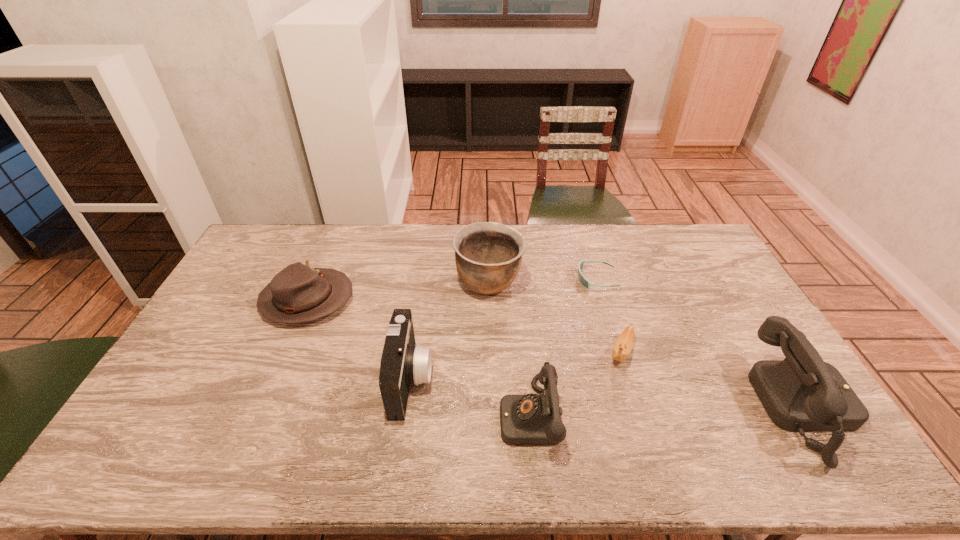
Locate an element on the screen. The image size is (960, 540). the shorter telephone is located at coordinates (533, 419).

The height and width of the screenshot is (540, 960). What are the coordinates of `the fourth shortest object` in the screenshot? It's located at (533, 419).

Locate an element on the screen. The width and height of the screenshot is (960, 540). the right telephone is located at coordinates (801, 393).

Identify the location of the rightmost object. (801, 393).

In order to click on goggles in this screenshot , I will do `click(583, 281)`.

This screenshot has height=540, width=960. Find the location of `pottery`. pottery is located at coordinates (488, 255).

The height and width of the screenshot is (540, 960). Identify the location of hat. (297, 294).

Identify the location of the fifth tallest object. This screenshot has width=960, height=540. (297, 294).

Where is `the second shortest object`? This screenshot has height=540, width=960. the second shortest object is located at coordinates (622, 348).

This screenshot has width=960, height=540. In order to click on camcorder in this screenshot , I will do `click(403, 363)`.